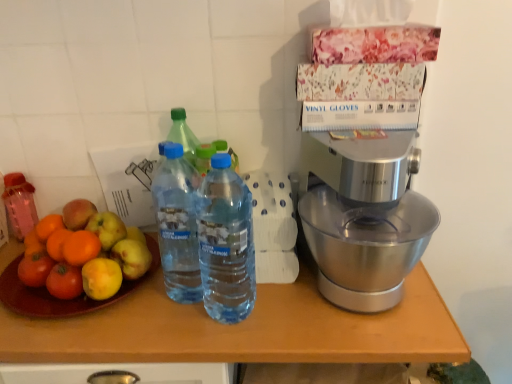
Question: Relative to transparent plastic bottle at center, acting as the 3th bottle starting from the back, is wooden table at center in front or behind?

Choices:
 (A) front
 (B) behind

Answer: (B)

Question: From a real-world perspective, relative to transparent plastic bottle at center, placed as the first bottle when sorted from front to back, is wooden table at center vertically above or below?

Choices:
 (A) above
 (B) below

Answer: (B)

Question: Which of these objects is positioned closest to the wooden table at center?

Choices:
 (A) shiny green apple at left
 (B) silver metallic mixer at right
 (C) blue plastic bottle at center, placed as the second bottle when sorted from right to left
 (D) pink translucent bottle at left, arranged as the third bottle when viewed from the right
 (E) transparent plastic bottle at center, which is counted as the 3th bottle, starting from the left

Answer: (E)

Question: Which is farther from the transparent plastic bottle at center, the first bottle positioned from the right?

Choices:
 (A) wooden table at center
 (B) blue plastic bottle at center, placed as the second bottle when sorted from right to left
 (C) pink translucent bottle at left, which is the 3th bottle in front-to-back order
 (D) silver metallic mixer at right
 (E) shiny green apple at left

Answer: (C)